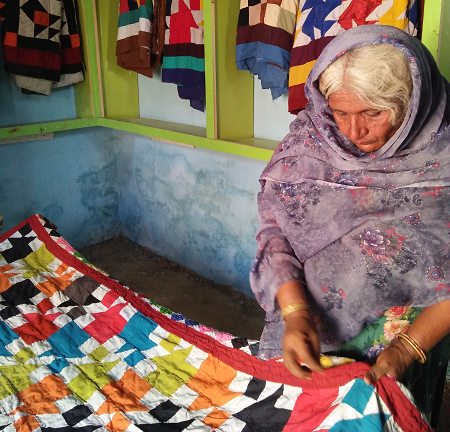
Locate an element on the screen. The width and height of the screenshot is (450, 432). colorful  quilts hanging on walls is located at coordinates (182, 75).